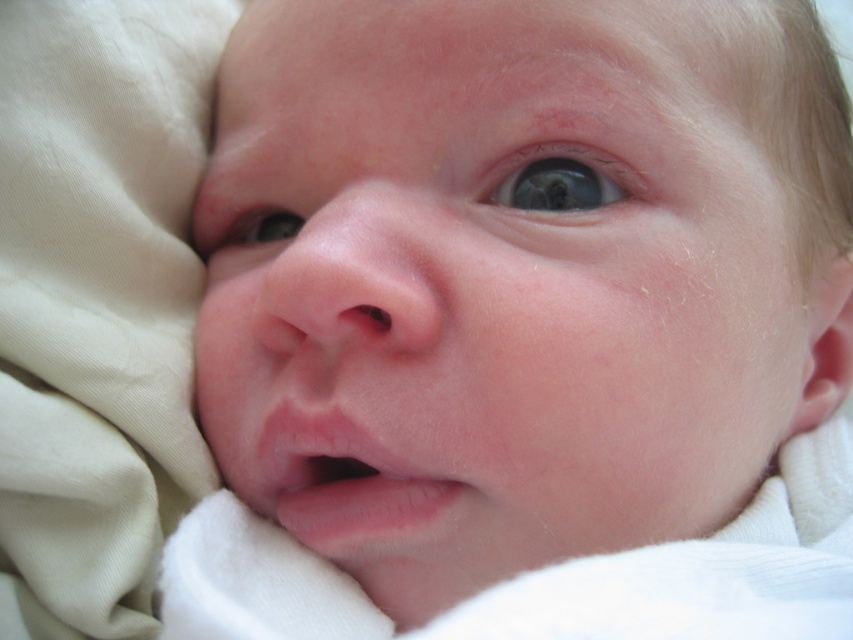
You are a photographer trying to frame a baby photo. You have a camera with a lens that can only focus on objects wider than 10 cm. Given the smooth skin face at center and the blue glossy eye at upper center, which one can the lens focus on?

The smooth skin face at center can be focused on because its width is larger than the blue glossy eye at upper center, and the lens requires objects wider than 10 cm. Since the face is wider, it likely meets the minimum width requirement.

You are a photographer taking a close up of a baby. The baby has a smooth skin face at center and a blue smooth eye at center. You want to ensure the eye is in focus while keeping the face visible. Given that the distance between them is 5.06 inches, what is the minimum depth of field required to keep both in focus?

The minimum depth of field required to keep both the smooth skin face at center and the blue smooth eye at center in focus is at least 5.06 inches, as that is the distance between them.

You are holding a baby and want to place a small sticker on the point at coordinates point (720,225). The sticker requires a minimum distance of 12 inches from the viewer to adhere properly. Can you safely apply the sticker at that point?

The distance of point (720,225) from viewer is 15.46 inches, which is greater than the required 12 inches. Therefore, you can safely apply the sticker at that point.